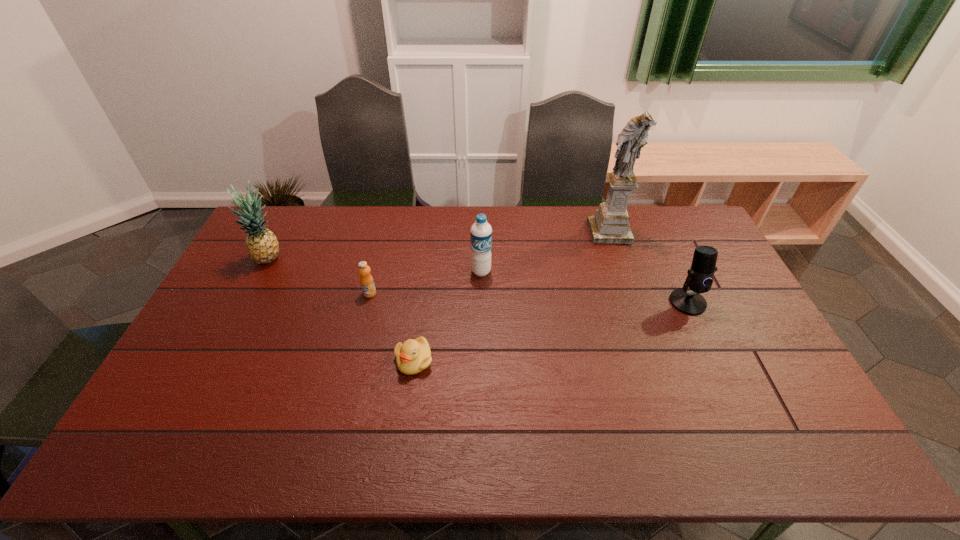
This screenshot has width=960, height=540. What are the coordinates of `vacant space at the near edge of the desktop` in the screenshot? It's located at (648, 450).

You are a GUI agent. You are given a task and a screenshot of the screen. Output one action in this format:
    pyautogui.click(x=<x>, y=<y>)
    Task: Click on the vacant area at the left edge of the desktop
    Image resolution: width=960 pixels, height=540 pixels.
    Given the screenshot: What is the action you would take?
    click(238, 348)

Image resolution: width=960 pixels, height=540 pixels. In the image, there is a desktop. Identify the location of vacant region at the right edge. (800, 403).

You are a GUI agent. You are given a task and a screenshot of the screen. Output one action in this format:
    pyautogui.click(x=<x>, y=<y>)
    Task: Click on the vacant space at the far left corner
    Image resolution: width=960 pixels, height=540 pixels.
    Given the screenshot: What is the action you would take?
    pyautogui.click(x=277, y=220)

At what (x,y) coordinates should I click in order to perform the action: click on free space at the near right corner of the desktop. Please return your answer as a coordinate pair (x, y). Looking at the image, I should click on (774, 428).

Image resolution: width=960 pixels, height=540 pixels. What are the coordinates of `vacant region between the pineapple and the fourth object from left to right` in the screenshot? It's located at (375, 265).

At what (x,y) coordinates should I click in order to perform the action: click on free spot between the water bottle and the nearest object. Please return your answer as a coordinate pair (x, y). The width and height of the screenshot is (960, 540). Looking at the image, I should click on (447, 316).

The height and width of the screenshot is (540, 960). What are the coordinates of `unoccupied position between the duckling and the orange juice` in the screenshot? It's located at 392,327.

Identify the location of unoccupied position between the fifth tallest object and the water bottle. This screenshot has height=540, width=960. coord(425,282).

The image size is (960, 540). Find the location of `free spot between the pineapple and the duckling`. free spot between the pineapple and the duckling is located at coordinates (342, 310).